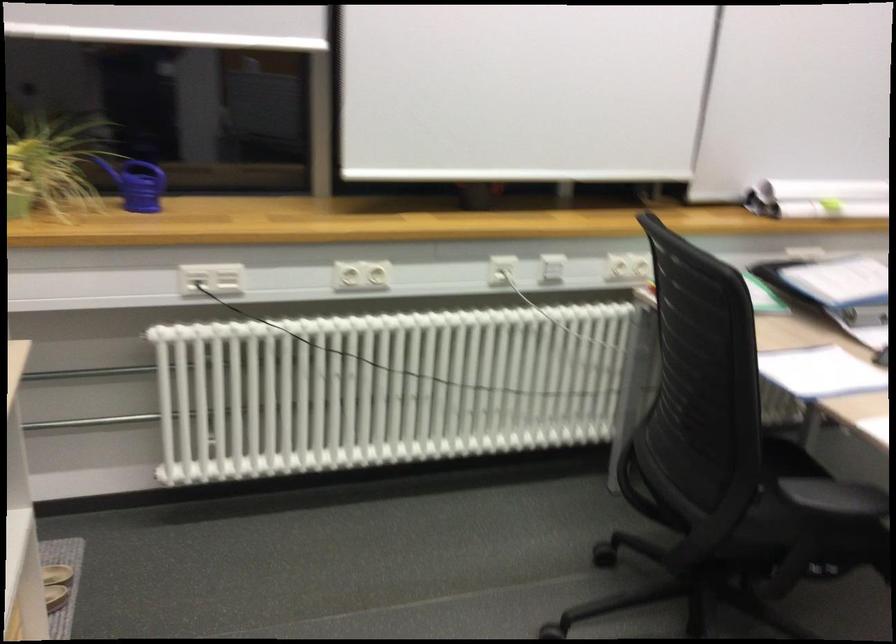
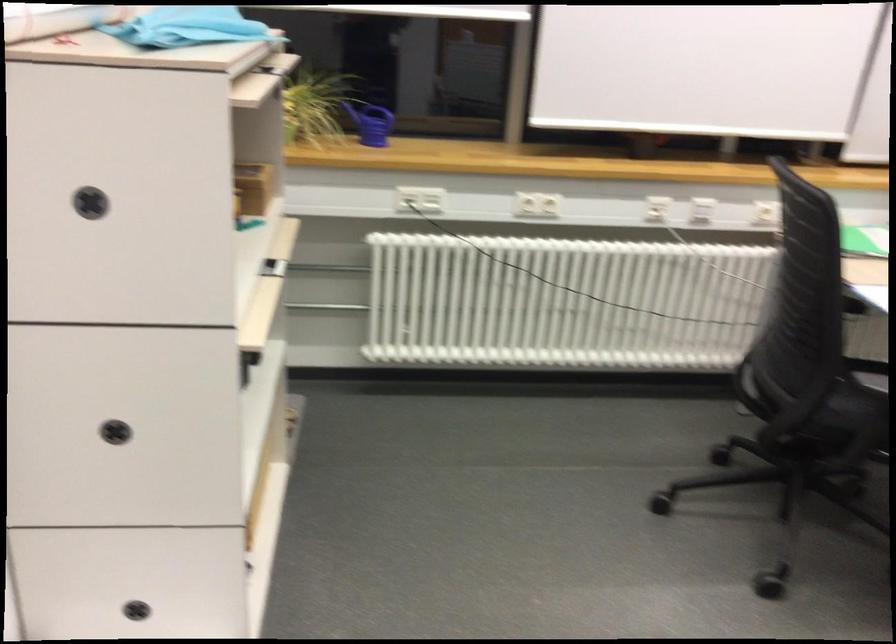
Question: The first image is from the beginning of the video and the second image is from the end. How did the camera likely rotate when shooting the video?

Choices:
 (A) Left
 (B) Right
 (C) Up
 (D) Down

Answer: (A)